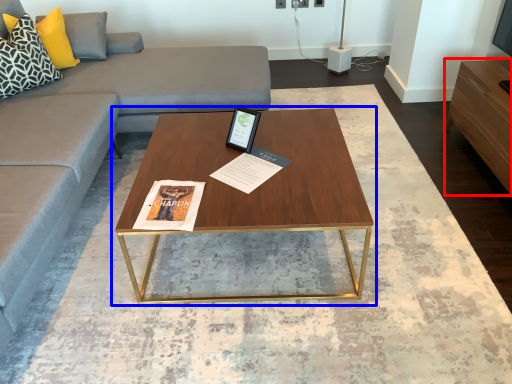
Question: Which point is closer to the camera, entertainment center (highlighted by a red box) or coffee table (highlighted by a blue box)?

Choices:
 (A) entertainment center
 (B) coffee table

Answer: (B)